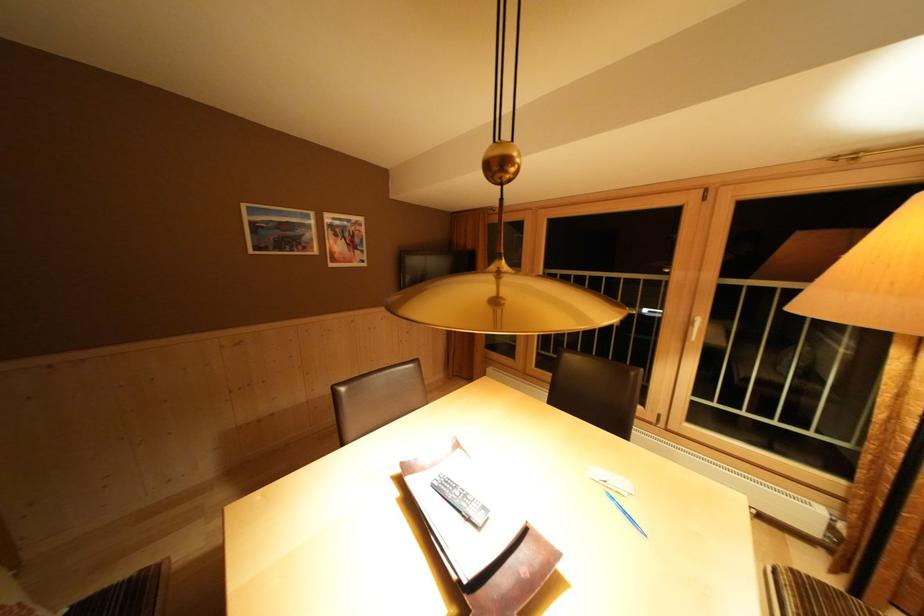
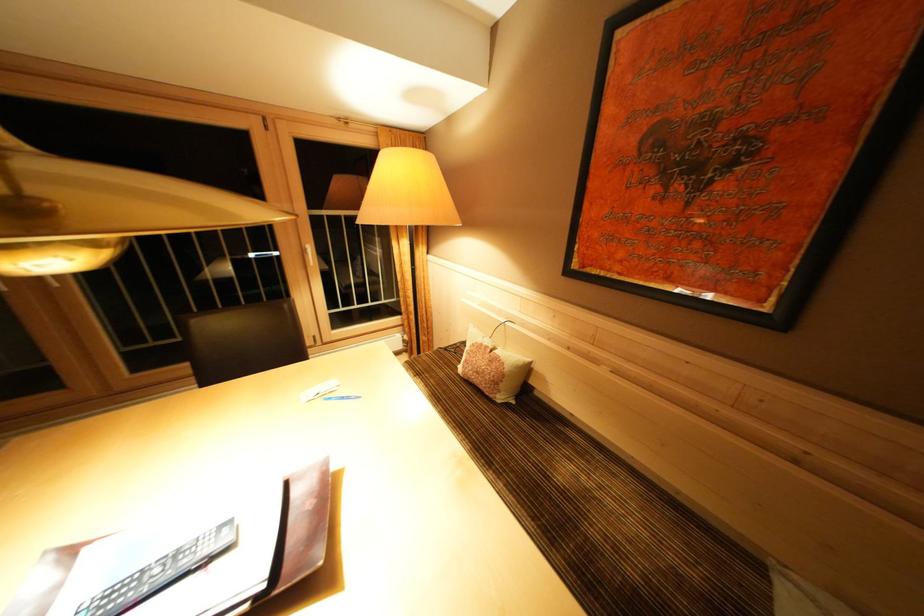
The point at (460,493) is marked in the first image. Where is the corresponding point in the second image?

(147, 584)